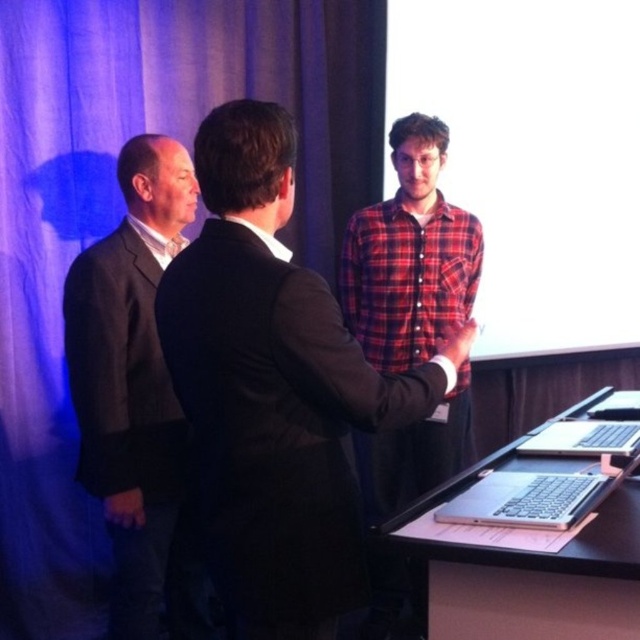
Question: Which point is farther to the camera?

Choices:
 (A) red plaid shirt at center
 (B) dark gray suit at left
 (C) blue fabric curtain at upper left

Answer: (A)

Question: Is blue fabric curtain at upper left to the right of silver metallic laptop at lower right from the viewer's perspective?

Choices:
 (A) yes
 (B) no

Answer: (B)

Question: Does dark gray suit at left have a smaller size compared to red plaid shirt at center?

Choices:
 (A) yes
 (B) no

Answer: (A)

Question: Which of the following is the farthest from the observer?

Choices:
 (A) (102, 298)
 (B) (284, 586)

Answer: (A)

Question: Which point is closer to the camera?

Choices:
 (A) click(x=275, y=502)
 (B) click(x=77, y=122)

Answer: (A)

Question: Can you confirm if dark suit at center is positioned to the right of red plaid shirt at center?

Choices:
 (A) yes
 (B) no

Answer: (B)